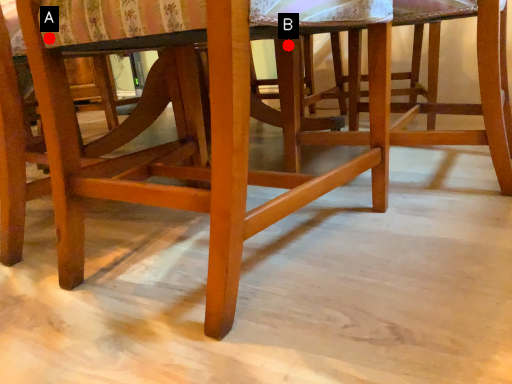
Question: Two points are circled on the image, labeled by A and B beside each circle. Which point is further to the camera?

Choices:
 (A) A is further
 (B) B is further

Answer: (B)